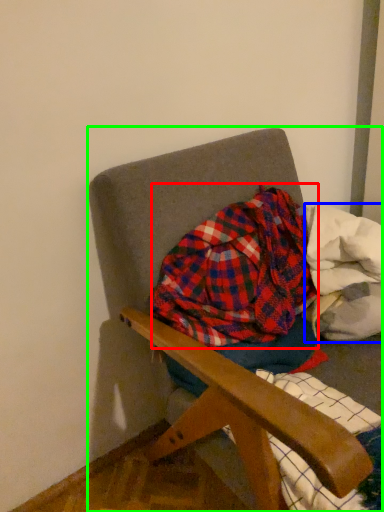
Question: Considering the real-world distances, which object is closest to flannel (highlighted by a red box)? material (highlighted by a blue box) or chair (highlighted by a green box).

Choices:
 (A) material
 (B) chair

Answer: (A)